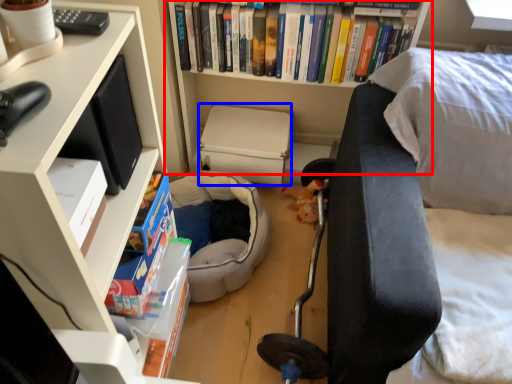
Question: Among these objects, which one is farthest to the camera, bookcase (highlighted by a red box) or paperback book (highlighted by a blue box)?

Choices:
 (A) bookcase
 (B) paperback book

Answer: (B)